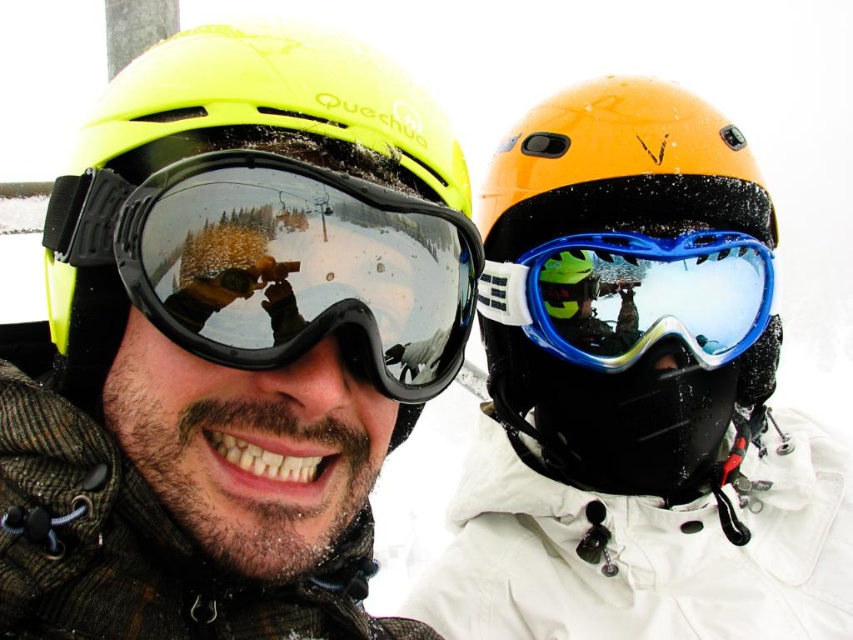
You are a photographer trying to capture a clear shot of both the matte yellow helmet at center and the blue glossy ski goggles at center. Since both are at the center, which one is more to the left?

The matte yellow helmet at center is positioned on the left side of blue glossy ski goggles at center, so the matte yellow helmet at center is more to the left.

You are designing a display stand for winter sports gear. You need to place the orange matte helmet at upper right and the blue glossy ski goggles at center on the same shelf. Considering their widths, which item should be placed first to ensure they both fit on the shelf without overlapping?

The orange matte helmet at upper right should be placed first since its width is greater than the blue glossy ski goggles at center, ensuring there is enough space for both items on the shelf.

You are a photographer trying to capture a closeup of the orange matte helmet at upper right. Based on its position at point coordinates, can you estimate whether it is closer to the top or the bottom of the image?

The orange matte helmet at upper right is located at point coordinates 0.447 along the horizontal axis and 0.730 along the vertical axis. Since the vertical coordinate is 0.730, which is closer to 1.0 than to 0.0, it is positioned closer to the top of the image.